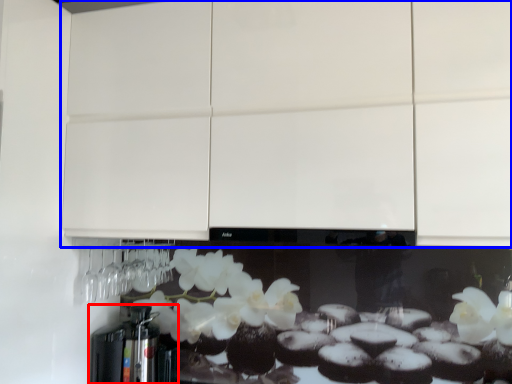
Question: Which of the following is the farthest to the observer, coffee machine (highlighted by a red box) or cabinetry (highlighted by a blue box)?

Choices:
 (A) coffee machine
 (B) cabinetry

Answer: (A)